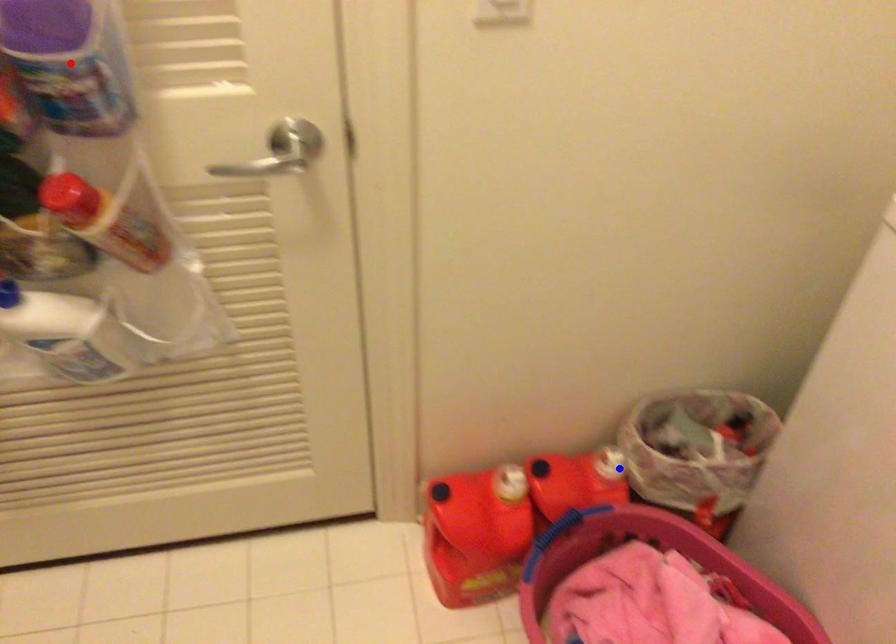
Question: In the image, two points are highlighted. Which point is nearer to the camera? Reply with the corresponding letter.

Choices:
 (A) blue point
 (B) red point

Answer: (B)